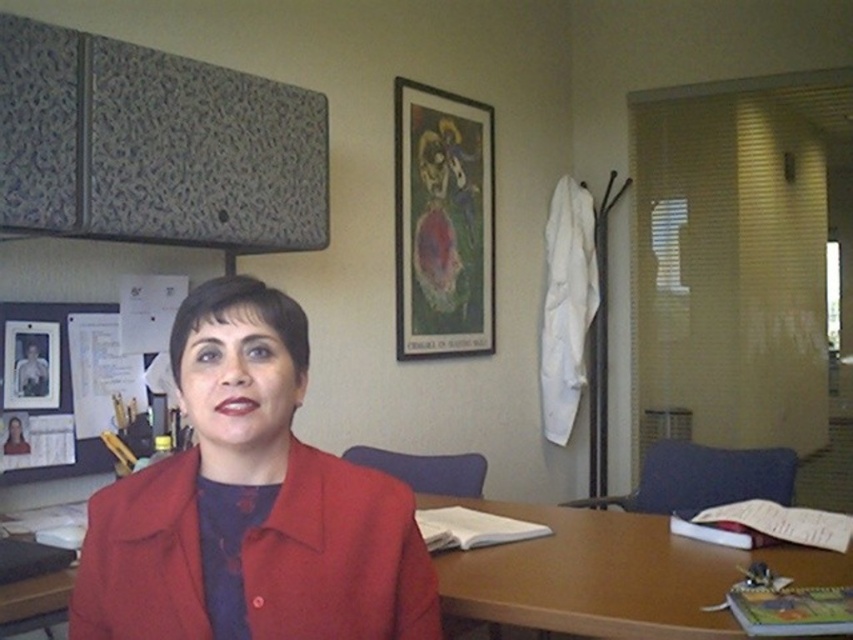
You are standing in the office and want to take a photo of the matte red jacket at center. If your camera has a minimum focusing distance of 1 meter, will you need to move closer or farther away to ensure the jacket is in focus?

The distance between the matte red jacket at center and the camera is 98.62 centimeters, which is less than 1 meter. Therefore, you need to move slightly farther away to meet the camera minimum focusing distance requirement.

You are a delivery person who needs to place a package between the matte red jacket at center and the metallic photo frame at upper left. The package is 3.5 feet long. Will it fit in the space between them?

The distance between the matte red jacket at center and the metallic photo frame at upper left is 4.09 feet. Since the package is 3.5 feet long, it will fit in the space between them as 3.5 is less than 4.09.

You are standing in the office and want to move from point A to point B. Point A is located at coordinate point (416,612) and point B is at coordinate point (674,621). According to the scene description, which point is closer to you?

Point (416,612) is in front of point (674,621), so point A is closer to you.